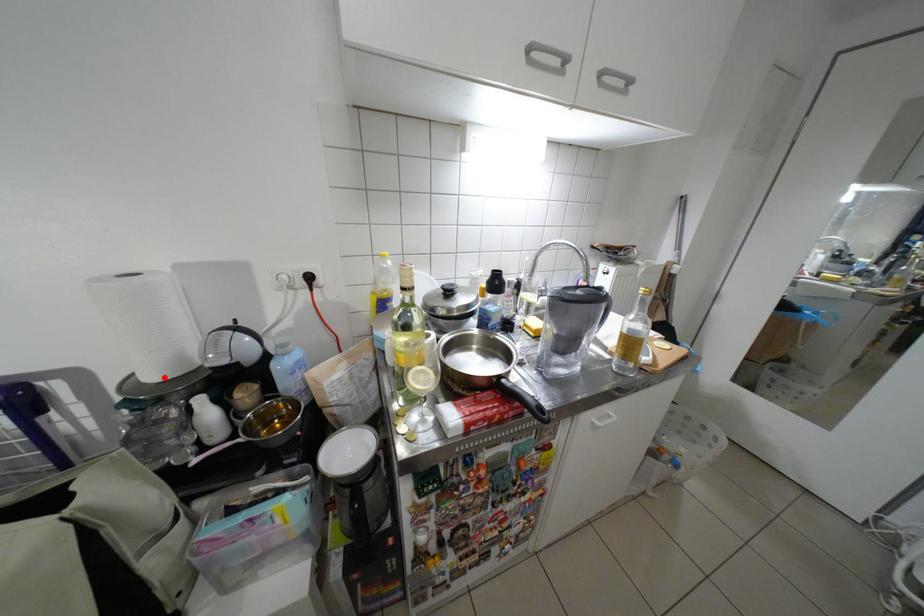
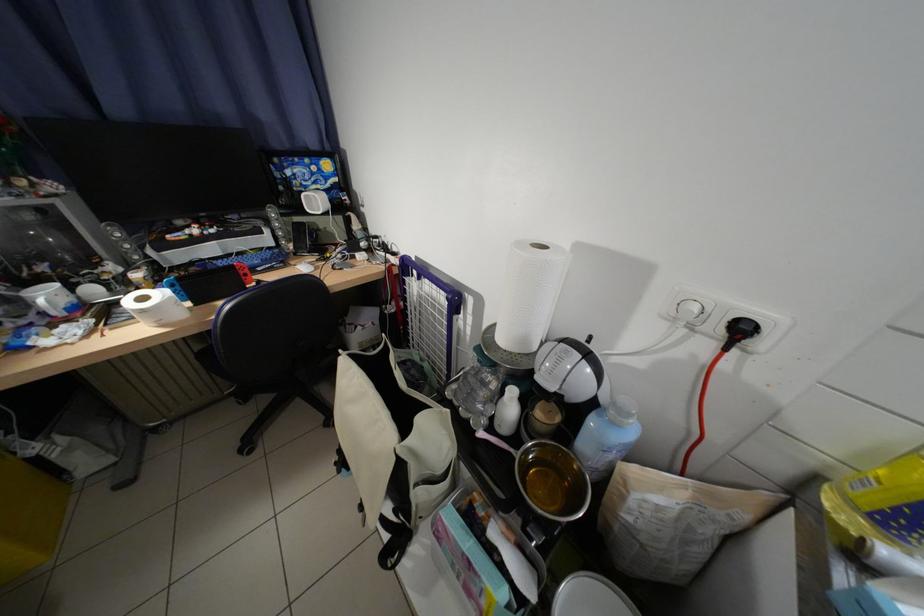
The point at the highlighted location is marked in the first image. Where is the corresponding point in the second image?

(514, 341)